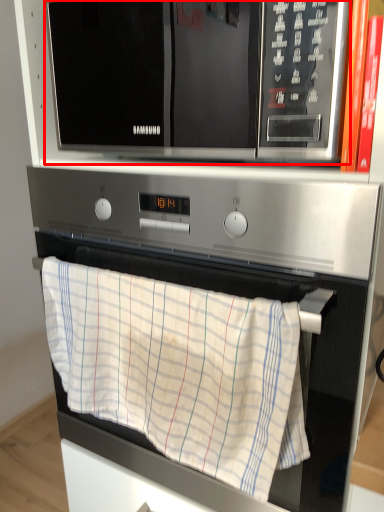
Question: From the image's perspective, what is the correct spatial relationship of microwave oven (annotated by the red box) in relation to oven?

Choices:
 (A) below
 (B) above

Answer: (B)